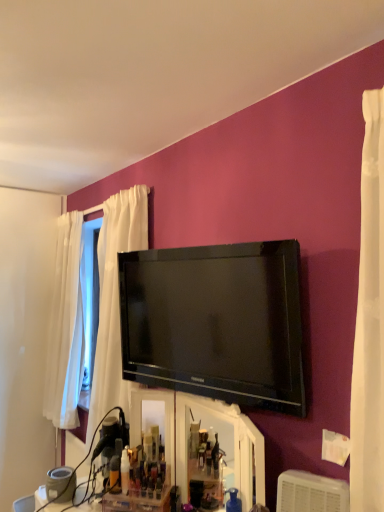
Question: Can you confirm if black glossy tv at upper center is taller than white plastic air conditioner at lower right?

Choices:
 (A) no
 (B) yes

Answer: (B)

Question: From the image's perspective, would you say black glossy tv at upper center is positioned over white plastic air conditioner at lower right?

Choices:
 (A) no
 (B) yes

Answer: (B)

Question: Can you confirm if black glossy tv at upper center is wider than white plastic air conditioner at lower right?

Choices:
 (A) yes
 (B) no

Answer: (B)

Question: Is black glossy tv at upper center next to white plastic air conditioner at lower right and touching it?

Choices:
 (A) yes
 (B) no

Answer: (B)

Question: Is black glossy tv at upper center far away from white plastic air conditioner at lower right?

Choices:
 (A) yes
 (B) no

Answer: (B)

Question: Looking at the image, does translucent plastic bottle at center seem bigger or smaller compared to white plastic air conditioner at lower right?

Choices:
 (A) small
 (B) big

Answer: (A)

Question: Considering their positions, is translucent plastic bottle at center located in front of or behind white plastic air conditioner at lower right?

Choices:
 (A) front
 (B) behind

Answer: (B)

Question: From the image's perspective, is translucent plastic bottle at center above or below white plastic air conditioner at lower right?

Choices:
 (A) above
 (B) below

Answer: (B)

Question: Is translucent plastic bottle at center to the left or to the right of white plastic air conditioner at lower right in the image?

Choices:
 (A) right
 (B) left

Answer: (B)

Question: Considering the positions of white plastic air conditioner at lower right and black glossy tv at upper center in the image, is white plastic air conditioner at lower right bigger or smaller than black glossy tv at upper center?

Choices:
 (A) small
 (B) big

Answer: (A)

Question: Relative to black glossy tv at upper center, is white plastic air conditioner at lower right in front or behind?

Choices:
 (A) front
 (B) behind

Answer: (A)

Question: Is white plastic air conditioner at lower right wider or thinner than black glossy tv at upper center?

Choices:
 (A) wide
 (B) thin

Answer: (A)

Question: Does point (311, 492) appear closer or farther from the camera than point (226, 282)?

Choices:
 (A) farther
 (B) closer

Answer: (B)

Question: From a real-world perspective, is translucent plastic bottle at center physically located above or below black glossy tv at upper center?

Choices:
 (A) below
 (B) above

Answer: (A)

Question: Looking at the image, does translucent plastic bottle at center seem bigger or smaller compared to black glossy tv at upper center?

Choices:
 (A) big
 (B) small

Answer: (B)